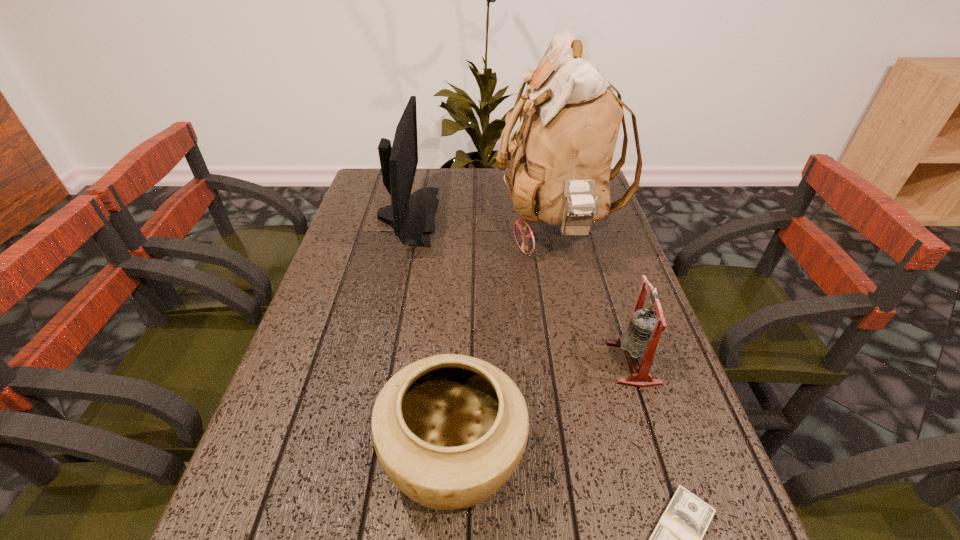
Identify which object is the nearest to the dollar. Please provide its 2D coordinates. Your answer should be formatted as a tuple, i.e. [(x, y)], where the tuple contains the x and y coordinates of a point satisfying the conditions above.

[(449, 430)]

Locate an element on the screen. vacant space that satisfies the following two spatial constraints: 1. on the front-facing side of the backpack; 2. on the right side of the bell is located at coordinates point(587,363).

Where is `free location that satisfies the following two spatial constraints: 1. on the screen side of the second tallest object; 2. on the left side of the bell`? This screenshot has height=540, width=960. free location that satisfies the following two spatial constraints: 1. on the screen side of the second tallest object; 2. on the left side of the bell is located at coordinates (374, 363).

You are a GUI agent. You are given a task and a screenshot of the screen. Output one action in this format:
    pyautogui.click(x=<x>, y=<y>)
    Task: Click on the vacant region that satisfies the following two spatial constraints: 1. on the screen side of the monitor; 2. on the right side of the fourth tallest object
    
    Given the screenshot: What is the action you would take?
    pyautogui.click(x=353, y=457)